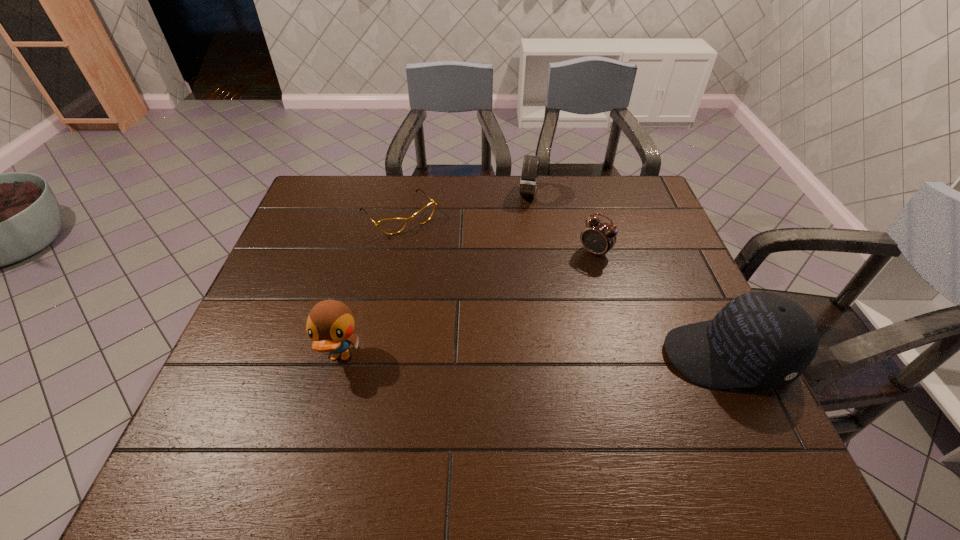
What are the coordinates of `unoccupied area between the baseball cap and the third object from right to left` in the screenshot? It's located at (628, 275).

The width and height of the screenshot is (960, 540). What are the coordinates of `empty location between the shortest object and the alarm clock` in the screenshot? It's located at (497, 233).

This screenshot has height=540, width=960. What are the coordinates of `free spot between the alarm clock and the third object from right to left` in the screenshot? It's located at tap(562, 223).

I want to click on vacant point located between the alarm clock and the shortest object, so click(x=497, y=233).

Locate an element on the screen. This screenshot has height=540, width=960. free spot between the duck and the shortest object is located at coordinates (370, 286).

You are a GUI agent. You are given a task and a screenshot of the screen. Output one action in this format:
    pyautogui.click(x=<x>, y=<y>)
    Task: Click on the empty space that is in between the third object from right to left and the duck
    
    Given the screenshot: What is the action you would take?
    point(434,275)

Locate an element on the screen. free space between the third object from right to left and the spectacles is located at coordinates (464, 204).

Find the location of a particular element. vacant space in between the shortest object and the rightmost object is located at coordinates (564, 285).

This screenshot has height=540, width=960. What are the coordinates of `blank region between the baseball cap and the alarm clock` in the screenshot? It's located at (661, 304).

Identify which object is the second closest to the watch. Please provide its 2D coordinates. Your answer should be formatted as a tuple, i.e. [(x, y)], where the tuple contains the x and y coordinates of a point satisfying the conditions above.

[(392, 225)]